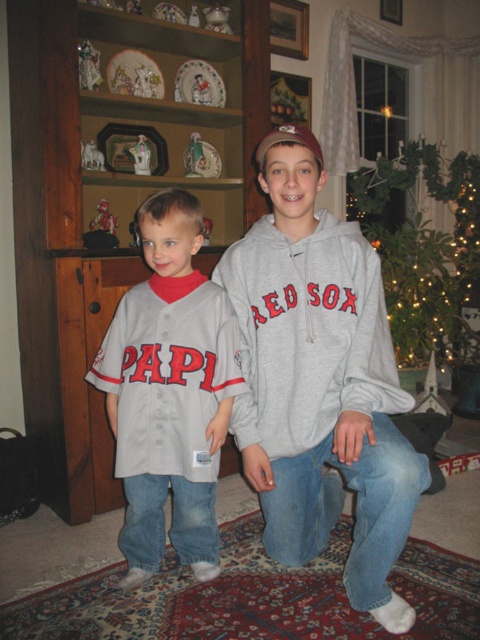
You are a photographer setting up for a family photo. You need to position the gray cotton hoodie at center and the iridescent glass ornaments at upper right in the frame. According to the scene, which object is closer to the left side of the frame?

The gray cotton hoodie at center is closer to the left side of the frame because it is positioned to the left of the iridescent glass ornaments at upper right.

You are a photographer trying to capture a clear photo of the gray cotton sweatshirt at center. However, the gray cotton hoodie at center is blocking your view. Can you determine if you need to move the hoodie up or down to get an unobstructed view of the sweatshirt?

The gray cotton hoodie at center is positioned under the gray cotton sweatshirt at center, so you need to move the hoodie down to get an unobstructed view of the sweatshirt.

Based on the photo, you are a photographer setting up a shot of the gray cotton sweatshirt at center and the iridescent glass ornaments at upper right. To avoid shadows from the ornaments falling on the sweatshirt, where should you position the light source relative to the ornaments?

The gray cotton sweatshirt at center is positioned under the iridescent glass ornaments at upper right. To prevent shadows from the ornaments from falling on the sweatshirt, the light source should be placed above the ornaments so that the shadow is cast upward away from the sweatshirt.